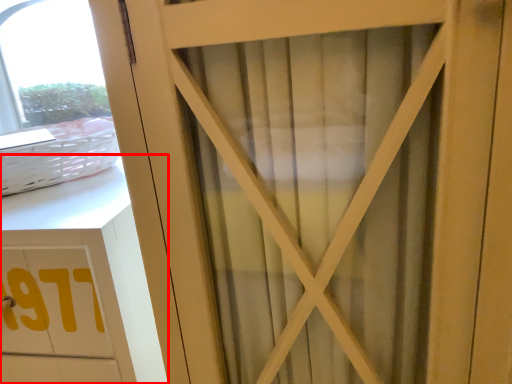
Question: Considering the relative positions of cabinetry (annotated by the red box) and basket in the image provided, where is cabinetry (annotated by the red box) located with respect to the staircase?

Choices:
 (A) right
 (B) left

Answer: (B)